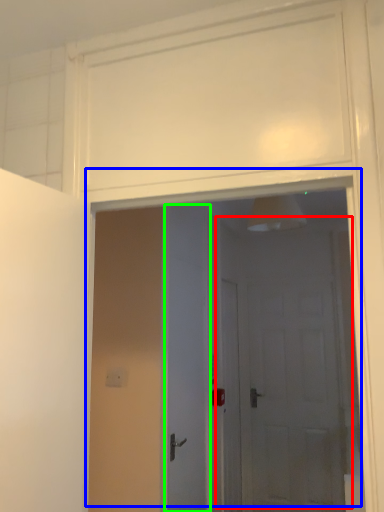
Question: Which object is the closest to the door (highlighted by a red box)? Choose among these: door (highlighted by a blue box) or door (highlighted by a green box).

Choices:
 (A) door
 (B) door

Answer: (A)